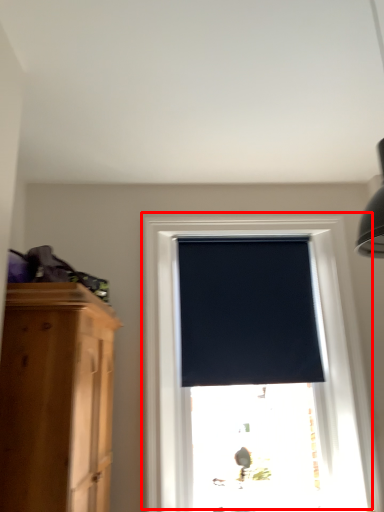
Question: From the image's perspective, where is window (annotated by the red box) located relative to window blind?

Choices:
 (A) above
 (B) below

Answer: (B)